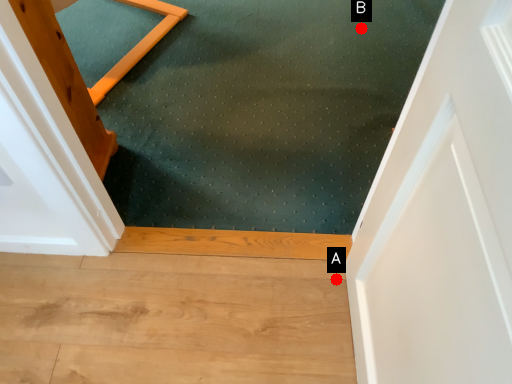
Question: Two points are circled on the image, labeled by A and B beside each circle. Which point appears closest to the camera in this image?

Choices:
 (A) A is closer
 (B) B is closer

Answer: (A)